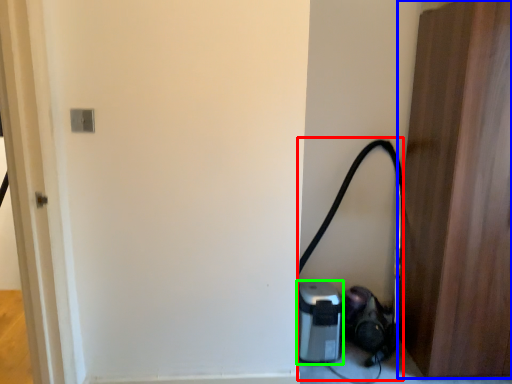
Question: Considering the real-world distances, which object is closest to garden hose (highlighted by a red box)? door (highlighted by a blue box) or appliance (highlighted by a green box).

Choices:
 (A) door
 (B) appliance

Answer: (B)